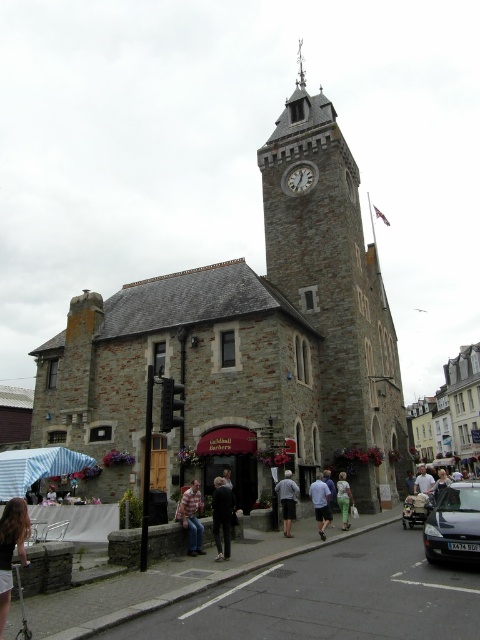
Question: Which object appears closest to the camera in this image?

Choices:
 (A) dark gray shorts at center
 (B) light blue denim shorts at center

Answer: (B)

Question: Observing the image, what is the correct spatial positioning of light blue denim jeans at center in reference to striped fabric umbrella at lower left?

Choices:
 (A) right
 (B) left

Answer: (A)

Question: Can you confirm if stone clock tower at center is positioned to the left of striped shirt at center?

Choices:
 (A) yes
 (B) no

Answer: (B)

Question: Observing the image, what is the correct spatial positioning of white stone clock at center in reference to light blue denim jeans at center?

Choices:
 (A) above
 (B) below

Answer: (A)

Question: Which of the following is the closest to the observer?

Choices:
 (A) silver metallic spire at upper center
 (B) striped fabric umbrella at lower left
 (C) blonde hair at lower left

Answer: (C)

Question: Which object is positioned closest to the light brown leather jacket at center?

Choices:
 (A) silver metallic spire at upper center
 (B) yellow stone building at center
 (C) striped shirt at center
 (D) blonde hair at lower left

Answer: (B)